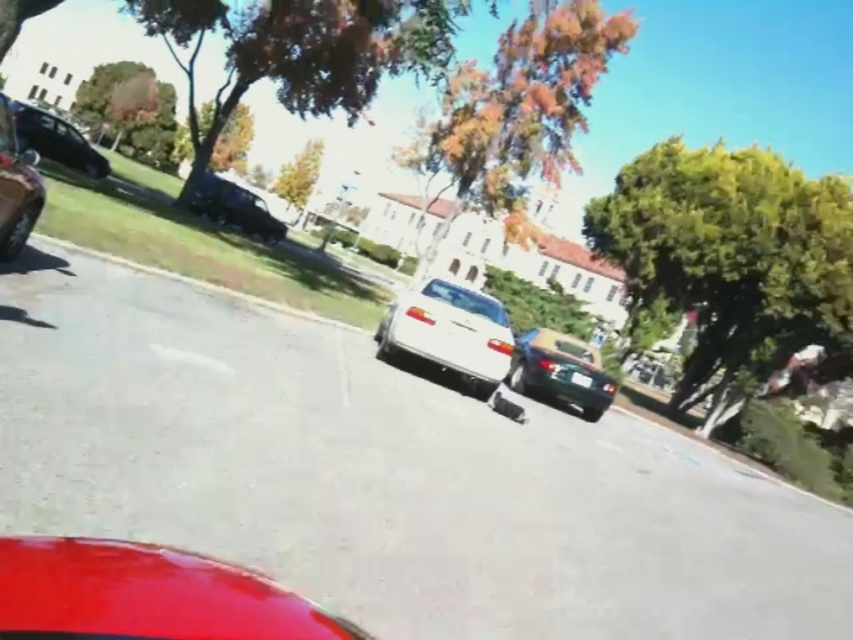
Does metallic green car at center have a greater width compared to shiny black car at left?

Indeed, metallic green car at center has a greater width compared to shiny black car at left.

Which of these two, metallic green car at center or shiny black car at left, stands taller?

metallic green car at center

Is point (572, 396) positioned before point (26, 189)?

That is False.

What are the coordinates of `metallic green car at center` in the screenshot? It's located at (560, 371).

Does shiny black sedan at upper left appear under gray asphalt curb at lower center?

Incorrect, shiny black sedan at upper left is not positioned below gray asphalt curb at lower center.

Describe the element at coordinates (56, 140) in the screenshot. This screenshot has height=640, width=853. I see `shiny black sedan at upper left` at that location.

Between point (80, 170) and point (164, 269), which one is positioned behind?

Positioned behind is point (80, 170).

Image resolution: width=853 pixels, height=640 pixels. Identify the location of shiny black sedan at upper left. (56, 140).

Measure the distance between white glossy sedan at center and camera.

white glossy sedan at center is 7.59 meters from camera.

Is point (486, 358) farther from camera compared to point (329, 317)?

No, it is not.

Which is in front, point (473, 300) or point (198, 280)?

Positioned in front is point (198, 280).

Identify the location of white glossy sedan at center. (450, 332).